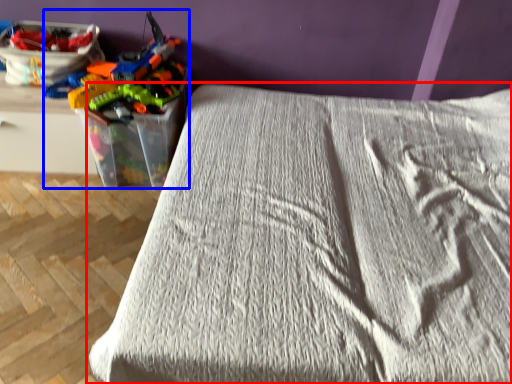
Question: Which point is closer to the camera, bed (highlighted by a red box) or toy (highlighted by a blue box)?

Choices:
 (A) bed
 (B) toy

Answer: (A)